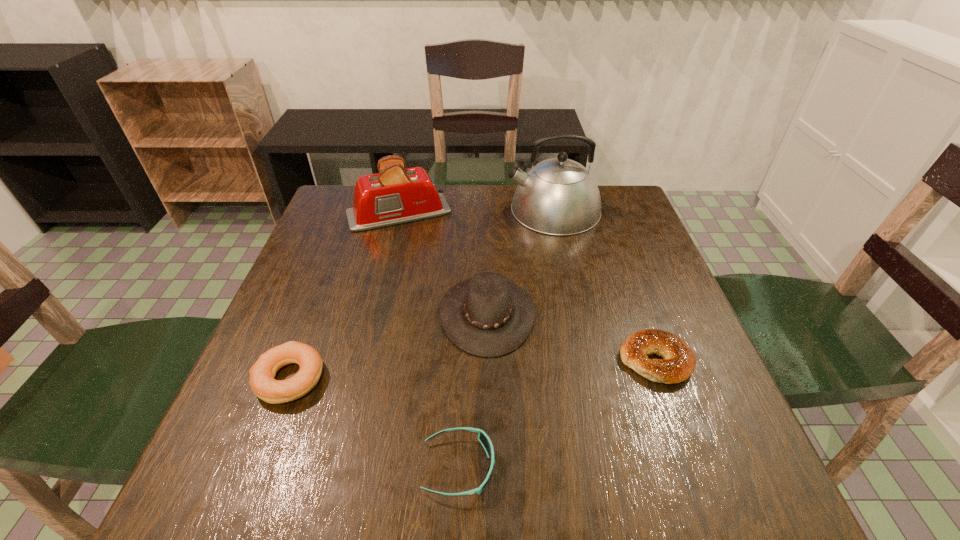
The width and height of the screenshot is (960, 540). Identify the location of vacant space situated on the front-facing side of the hat. (279, 314).

The image size is (960, 540). I want to click on free region located on the front-facing side of the hat, so click(x=342, y=314).

You are a GUI agent. You are given a task and a screenshot of the screen. Output one action in this format:
    pyautogui.click(x=<x>, y=<y>)
    Task: Click on the vacant area situated on the front-facing side of the hat
    This screenshot has height=540, width=960.
    Given the screenshot: What is the action you would take?
    pyautogui.click(x=400, y=314)

The width and height of the screenshot is (960, 540). I want to click on vacant space situated 0.150m on the front of the left bagel, so click(246, 493).

Locate an element on the screen. The image size is (960, 540). free region located 0.120m on the back of the right bagel is located at coordinates [632, 296].

You are a GUI agent. You are given a task and a screenshot of the screen. Output one action in this format:
    pyautogui.click(x=<x>, y=<y>)
    Task: Click on the vacant region located 0.260m on the front-facing side of the sunglasses
    The image size is (960, 540).
    Given the screenshot: What is the action you would take?
    pyautogui.click(x=653, y=467)

At what (x,y) coordinates should I click in order to perform the action: click on kettle located at the far edge. Please return your answer as a coordinate pair (x, y). The image size is (960, 540). Looking at the image, I should click on [x=558, y=196].

At what (x,y) coordinates should I click in order to perform the action: click on toaster that is at the far edge. Please return your answer as a coordinate pair (x, y). The height and width of the screenshot is (540, 960). Looking at the image, I should click on (395, 195).

At what (x,y) coordinates should I click in order to perform the action: click on object at the near edge. Please return your answer as a coordinate pair (x, y). Looking at the image, I should click on (483, 438).

Where is `toaster present at the left edge`? Image resolution: width=960 pixels, height=540 pixels. toaster present at the left edge is located at coordinates (395, 195).